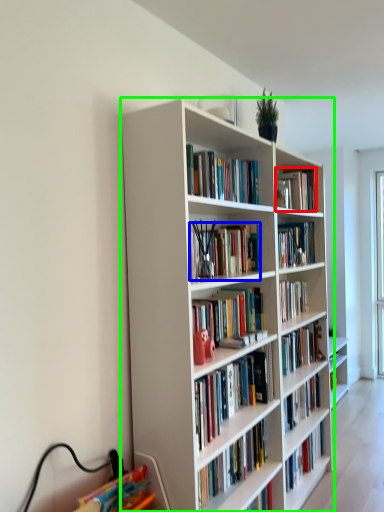
Question: Which object is the farthest from book (highlighted by a red box)? Choose among these: book (highlighted by a blue box) or bookcase (highlighted by a green box).

Choices:
 (A) book
 (B) bookcase

Answer: (B)